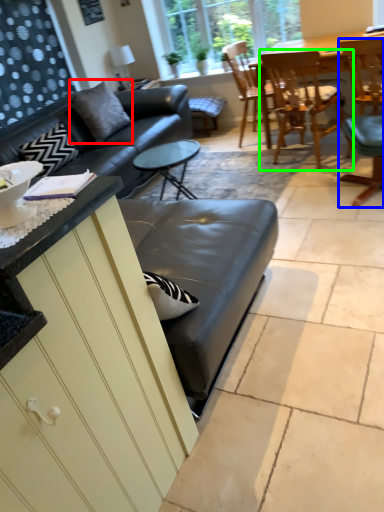
Question: Considering the real-world distances, which object is farthest from pillow (highlighted by a red box)? chair (highlighted by a blue box) or chair (highlighted by a green box)?

Choices:
 (A) chair
 (B) chair

Answer: (A)